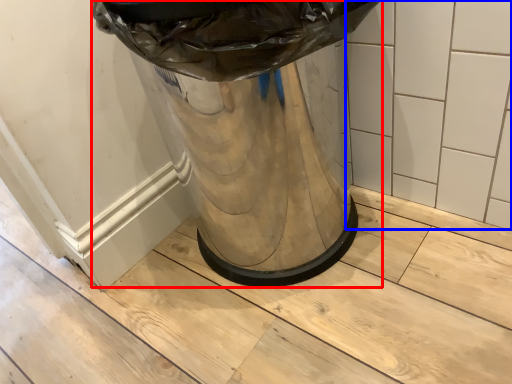
Question: Which of the following is the farthest to the observer, waste container (highlighted by a red box) or tile (highlighted by a blue box)?

Choices:
 (A) waste container
 (B) tile

Answer: (B)